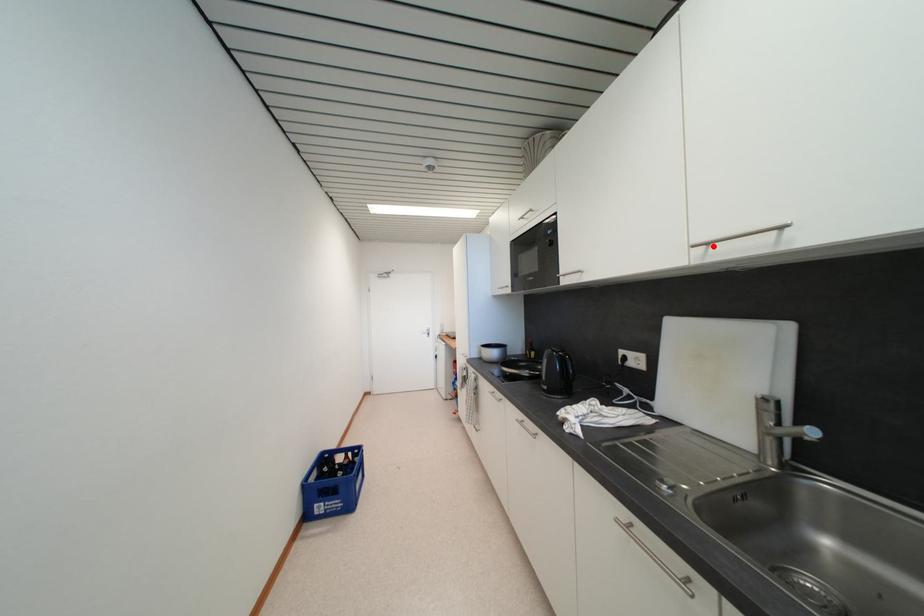
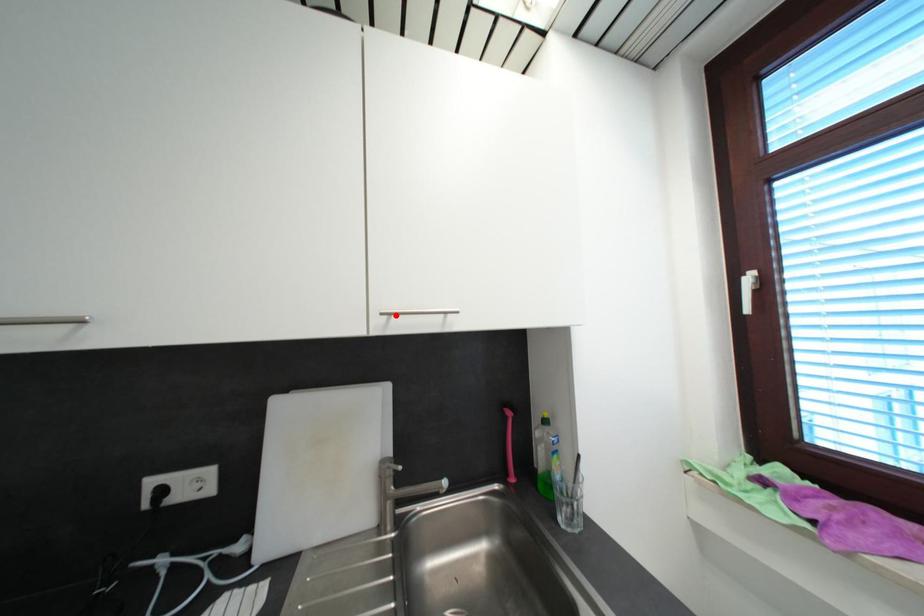
Consider the image. I am providing you with two images of the same scene from different viewpoints. A red point is marked on the first image and another point is marked on the second image. Is the red point in image1 aligned with the point shown in image2?

Yes